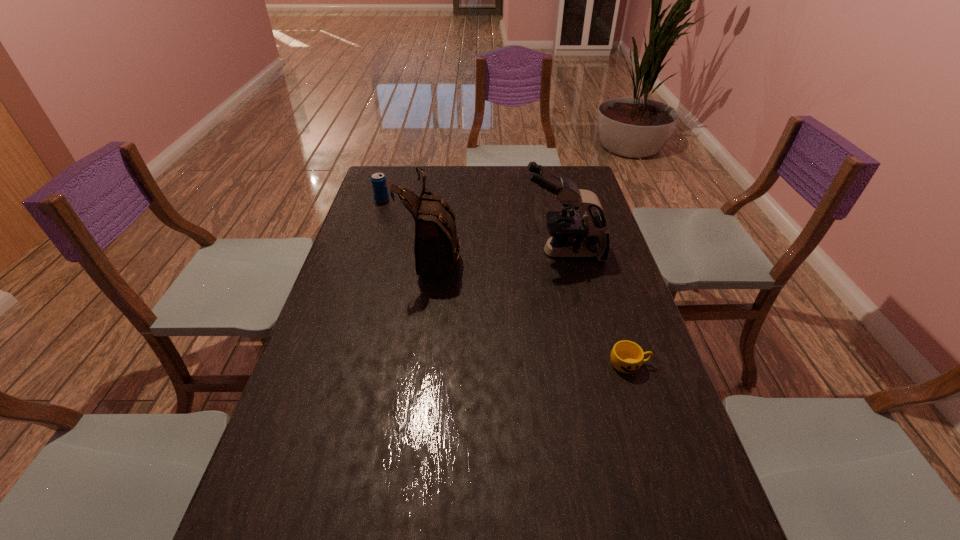
At what (x,y) coordinates should I click in order to perform the action: click on shoulder bag. Please return your answer as a coordinate pair (x, y). Looking at the image, I should click on (435, 247).

The width and height of the screenshot is (960, 540). Find the location of `microscope`. microscope is located at coordinates (571, 235).

In order to click on the leftmost object in this screenshot , I will do `click(379, 184)`.

The height and width of the screenshot is (540, 960). What are the coordinates of `the farthest object` in the screenshot? It's located at (379, 184).

Image resolution: width=960 pixels, height=540 pixels. In order to click on the shortest object in this screenshot , I will do `click(627, 357)`.

What are the coordinates of `the nearest object` in the screenshot? It's located at (627, 357).

At what (x,y) coordinates should I click in order to perform the action: click on free spot located on the front-facing side of the second object from left to right. Please return your answer as a coordinate pair (x, y). Looking at the image, I should click on (476, 255).

Where is `vacant point located through the eyepieces of the microscope`? Image resolution: width=960 pixels, height=540 pixels. vacant point located through the eyepieces of the microscope is located at coordinates (453, 252).

The height and width of the screenshot is (540, 960). I want to click on vacant space located through the eyepieces of the microscope, so click(x=477, y=252).

The image size is (960, 540). I want to click on blank space located through the eyepieces of the microscope, so click(x=486, y=252).